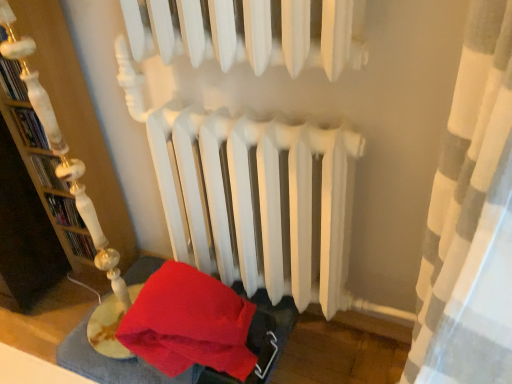
Measure the distance between point (x=85, y=334) and camera.

A distance of 1.44 meters exists between point (x=85, y=334) and camera.

Describe the element at coordinates (112, 363) in the screenshot. I see `velvet red blanket at lower left` at that location.

Where is `velvet red blanket at lower left`? This screenshot has width=512, height=384. velvet red blanket at lower left is located at coordinates (112, 363).

This screenshot has height=384, width=512. What do you see at coordinates (63, 158) in the screenshot? I see `wooden bookshelf at left` at bounding box center [63, 158].

Measure the distance between point (78, 208) and camera.

Point (78, 208) is 3.81 feet away from camera.

Identify the location of wooden bookshelf at left. (63, 158).

The image size is (512, 384). I want to click on velvet red blanket at lower left, so click(112, 363).

Is velvet red blanket at lower left at the right side of wooden bookshelf at left?

Correct, you'll find velvet red blanket at lower left to the right of wooden bookshelf at left.

Considering the positions of objects velvet red blanket at lower left and wooden bookshelf at left in the image provided, who is behind, velvet red blanket at lower left or wooden bookshelf at left?

Result: velvet red blanket at lower left.

Considering the points (140, 264) and (84, 215), which point is in front, point (140, 264) or point (84, 215)?

The point (84, 215) is closer.

From the image's perspective, is velvet red blanket at lower left on top of wooden bookshelf at left?

No, from the image's perspective, velvet red blanket at lower left is not over wooden bookshelf at left.

From a real-world perspective, is velvet red blanket at lower left on top of wooden bookshelf at left?

No, from a real-world perspective, velvet red blanket at lower left is not above wooden bookshelf at left.

Which of these two, velvet red blanket at lower left or wooden bookshelf at left, is wider?

velvet red blanket at lower left.

Which of these two, velvet red blanket at lower left or wooden bookshelf at left, stands taller?

With more height is wooden bookshelf at left.

Can you confirm if velvet red blanket at lower left is bigger than wooden bookshelf at left?

No, velvet red blanket at lower left is not bigger than wooden bookshelf at left.

Do you think velvet red blanket at lower left is within wooden bookshelf at left, or outside of it?

velvet red blanket at lower left is not inside wooden bookshelf at left, it's outside.

Is velvet red blanket at lower left not near wooden bookshelf at left?

velvet red blanket at lower left is near wooden bookshelf at left, not far away.

Is velvet red blanket at lower left positioned with its back to wooden bookshelf at left?

No, velvet red blanket at lower left is not facing away from wooden bookshelf at left.

What's the angular difference between velvet red blanket at lower left and wooden bookshelf at left's facing directions?

velvet red blanket at lower left and wooden bookshelf at left are facing 1.48 degrees away from each other.

Where is `bookshelf located in front of the velvet red blanket at lower left`? This screenshot has height=384, width=512. bookshelf located in front of the velvet red blanket at lower left is located at coordinates (63, 158).

Is wooden bookshelf at left to the left of velvet red blanket at lower left from the viewer's perspective?

Yes, wooden bookshelf at left is to the left of velvet red blanket at lower left.

Considering their positions, is wooden bookshelf at left located in front of or behind velvet red blanket at lower left?

In the image, wooden bookshelf at left appears in front of velvet red blanket at lower left.

Does point (37, 83) lie behind point (70, 365)?

No, it is not.

From the image's perspective, does wooden bookshelf at left appear lower than velvet red blanket at lower left?

Actually, wooden bookshelf at left appears above velvet red blanket at lower left in the image.

From a real-world perspective, is wooden bookshelf at left over velvet red blanket at lower left?

Yes.

Considering the sizes of wooden bookshelf at left and velvet red blanket at lower left in the image, is wooden bookshelf at left wider or thinner than velvet red blanket at lower left?

wooden bookshelf at left is thinner than velvet red blanket at lower left.

In terms of height, does wooden bookshelf at left look taller or shorter compared to velvet red blanket at lower left?

Considering their sizes, wooden bookshelf at left has more height than velvet red blanket at lower left.

Based on the photo, considering the sizes of wooden bookshelf at left and velvet red blanket at lower left in the image, is wooden bookshelf at left bigger or smaller than velvet red blanket at lower left?

Considering their sizes, wooden bookshelf at left takes up more space than velvet red blanket at lower left.

Which is correct: wooden bookshelf at left is inside velvet red blanket at lower left, or outside of it?

wooden bookshelf at left cannot be found inside velvet red blanket at lower left.

Is wooden bookshelf at left not near velvet red blanket at lower left?

No, wooden bookshelf at left is in close proximity to velvet red blanket at lower left.

Is wooden bookshelf at left facing towards velvet red blanket at lower left?

No, wooden bookshelf at left is not turned towards velvet red blanket at lower left.

Can you tell me how much wooden bookshelf at left and velvet red blanket at lower left differ in facing direction?

They differ by 1.48 degrees in their facing directions.

Where is `bookshelf above the velvet red blanket at lower left (from a real-world perspective)`? This screenshot has width=512, height=384. bookshelf above the velvet red blanket at lower left (from a real-world perspective) is located at coordinates (63, 158).

The width and height of the screenshot is (512, 384). I want to click on bookshelf above the velvet red blanket at lower left (from a real-world perspective), so click(x=63, y=158).

Locate an element on the screen. Image resolution: width=512 pixels, height=384 pixels. bed frame below the wooden bookshelf at left (from a real-world perspective) is located at coordinates pyautogui.click(x=112, y=363).